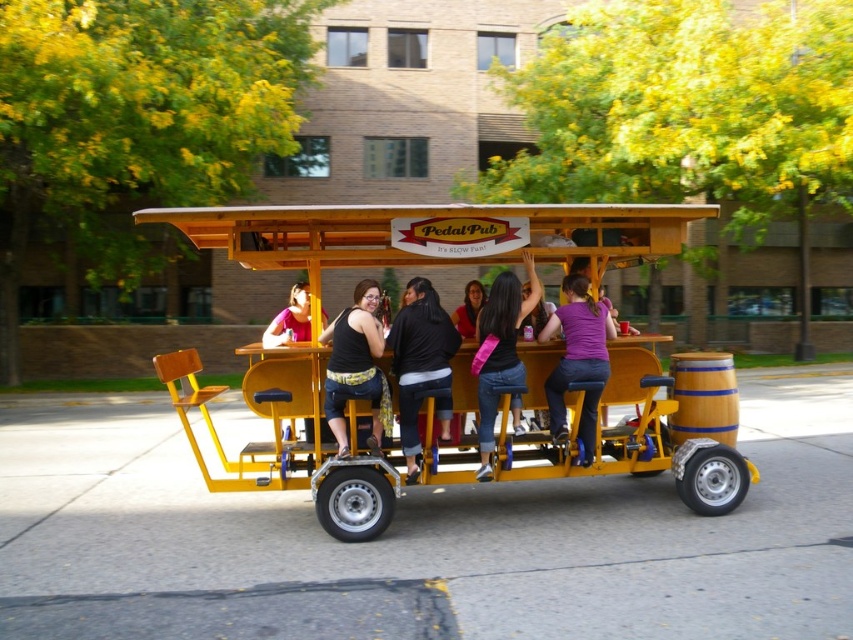
You are a photographer standing in front of the Pedal Pub. You notice two people wearing matte black tank top at center and matte black shirt at center. Which one is more visible to you?

The matte black tank top at center is more visible to you because it is closer to the viewer than the matte black shirt at center.

Consider the image. You are a passenger sitting in the Pedal Pub and want to reach a snack placed at point (654, 464). You see another object at point (399, 364). Which point is closer to you?

Point (654, 464) is further to the viewer than point (399, 364), so the snack at point (654, 464) is closer to you than the other object at point (399, 364).